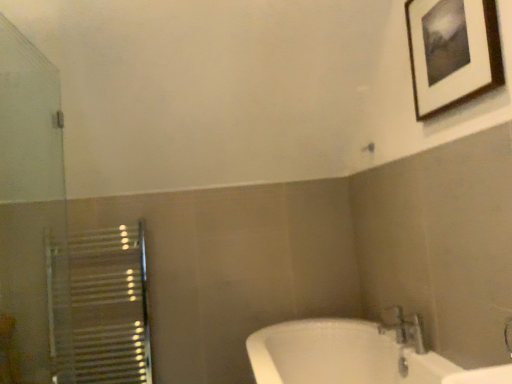
Question: From the image's perspective, is transparent glass screen door at left beneath metallic silver faucet at lower right?

Choices:
 (A) yes
 (B) no

Answer: (B)

Question: Considering the relative sizes of transparent glass screen door at left and metallic silver faucet at lower right in the image provided, is transparent glass screen door at left thinner than metallic silver faucet at lower right?

Choices:
 (A) yes
 (B) no

Answer: (A)

Question: Is transparent glass screen door at left facing towards metallic silver faucet at lower right?

Choices:
 (A) no
 (B) yes

Answer: (A)

Question: Is transparent glass screen door at left bigger than metallic silver faucet at lower right?

Choices:
 (A) no
 (B) yes

Answer: (B)

Question: Is transparent glass screen door at left at the right side of metallic silver faucet at lower right?

Choices:
 (A) yes
 (B) no

Answer: (B)

Question: Is wooden-framed picture at upper right situated inside transparent glass screen door at left or outside?

Choices:
 (A) inside
 (B) outside

Answer: (B)

Question: In the image, is wooden-framed picture at upper right positioned in front of or behind transparent glass screen door at left?

Choices:
 (A) front
 (B) behind

Answer: (B)

Question: Is wooden-framed picture at upper right to the left or to the right of transparent glass screen door at left in the image?

Choices:
 (A) right
 (B) left

Answer: (A)

Question: From the image's perspective, relative to transparent glass screen door at left, is wooden-framed picture at upper right above or below?

Choices:
 (A) below
 (B) above

Answer: (B)

Question: Based on their positions, is wooden-framed picture at upper right located to the left or right of metallic silver faucet at lower right?

Choices:
 (A) right
 (B) left

Answer: (A)

Question: Based on their sizes in the image, would you say wooden-framed picture at upper right is bigger or smaller than metallic silver faucet at lower right?

Choices:
 (A) small
 (B) big

Answer: (A)

Question: Considering the positions of wooden-framed picture at upper right and metallic silver faucet at lower right in the image, is wooden-framed picture at upper right taller or shorter than metallic silver faucet at lower right?

Choices:
 (A) tall
 (B) short

Answer: (A)

Question: Considering the positions of point (423, 26) and point (421, 345), is point (423, 26) closer or farther from the camera than point (421, 345)?

Choices:
 (A) farther
 (B) closer

Answer: (B)

Question: Considering the positions of transparent glass screen door at left and metallic silver faucet at lower right in the image, is transparent glass screen door at left wider or thinner than metallic silver faucet at lower right?

Choices:
 (A) thin
 (B) wide

Answer: (A)

Question: Is point (33, 163) positioned closer to the camera than point (398, 307)?

Choices:
 (A) closer
 (B) farther

Answer: (B)